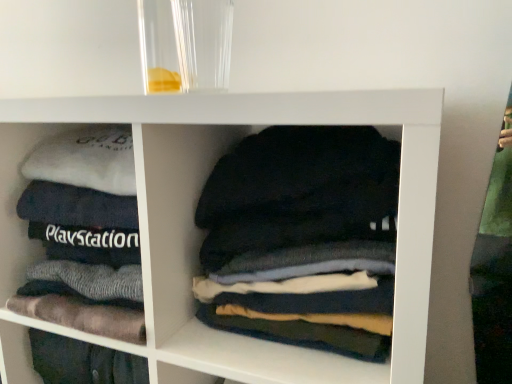
Question: Is white soft fabric at left thinner than dark gray cotton shirts at center?

Choices:
 (A) yes
 (B) no

Answer: (B)

Question: Can you confirm if white soft fabric at left is shorter than dark gray cotton shirts at center?

Choices:
 (A) yes
 (B) no

Answer: (B)

Question: From a real-world perspective, is white soft fabric at left on dark gray cotton shirts at center?

Choices:
 (A) no
 (B) yes

Answer: (B)

Question: From a real-world perspective, is white soft fabric at left positioned under dark gray cotton shirts at center based on gravity?

Choices:
 (A) yes
 (B) no

Answer: (B)

Question: From the image's perspective, is white soft fabric at left on top of dark gray cotton shirts at center?

Choices:
 (A) no
 (B) yes

Answer: (B)

Question: Considering the relative sizes of white soft fabric at left and dark gray cotton shirts at center in the image provided, is white soft fabric at left bigger than dark gray cotton shirts at center?

Choices:
 (A) no
 (B) yes

Answer: (B)

Question: Is dark gray cotton shirts at center to the right of white soft fabric at left from the viewer's perspective?

Choices:
 (A) no
 (B) yes

Answer: (B)

Question: Is dark gray cotton shirts at center facing away from white soft fabric at left?

Choices:
 (A) no
 (B) yes

Answer: (A)

Question: Does dark gray cotton shirts at center appear on the left side of white soft fabric at left?

Choices:
 (A) yes
 (B) no

Answer: (B)

Question: Is white soft fabric at left inside dark gray cotton shirts at center?

Choices:
 (A) no
 (B) yes

Answer: (A)

Question: Is dark gray cotton shirts at center wider than white soft fabric at left?

Choices:
 (A) no
 (B) yes

Answer: (A)

Question: Is dark gray cotton shirts at center beside white soft fabric at left?

Choices:
 (A) no
 (B) yes

Answer: (A)

Question: From the image's perspective, relative to dark gray cotton shirts at center, is white soft fabric at left above or below?

Choices:
 (A) above
 (B) below

Answer: (A)